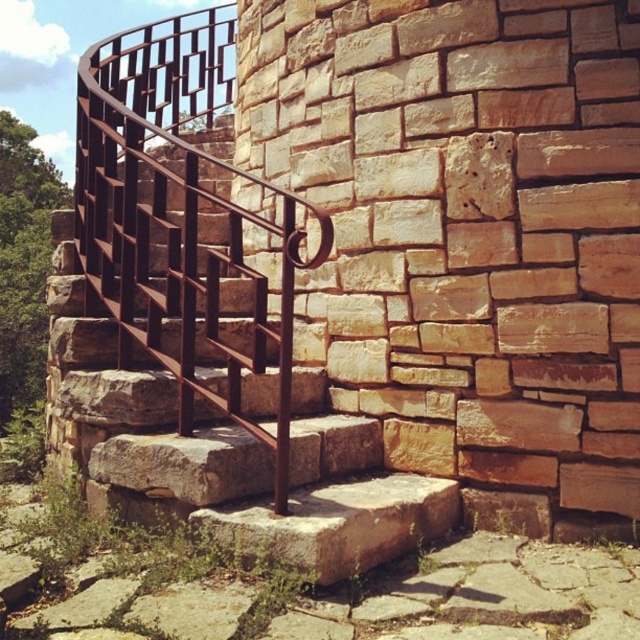
Does rusty metal stairwell at center have a lesser height compared to rusty metal railing at center?

In fact, rusty metal stairwell at center may be taller than rusty metal railing at center.

Which is behind, point (244, 336) or point (294, 216)?

Positioned behind is point (244, 336).

Who is more forward, (300, 497) or (284, 384)?

Positioned in front is point (284, 384).

Find the location of a particular element. The width and height of the screenshot is (640, 640). rusty metal stairwell at center is located at coordinates (227, 452).